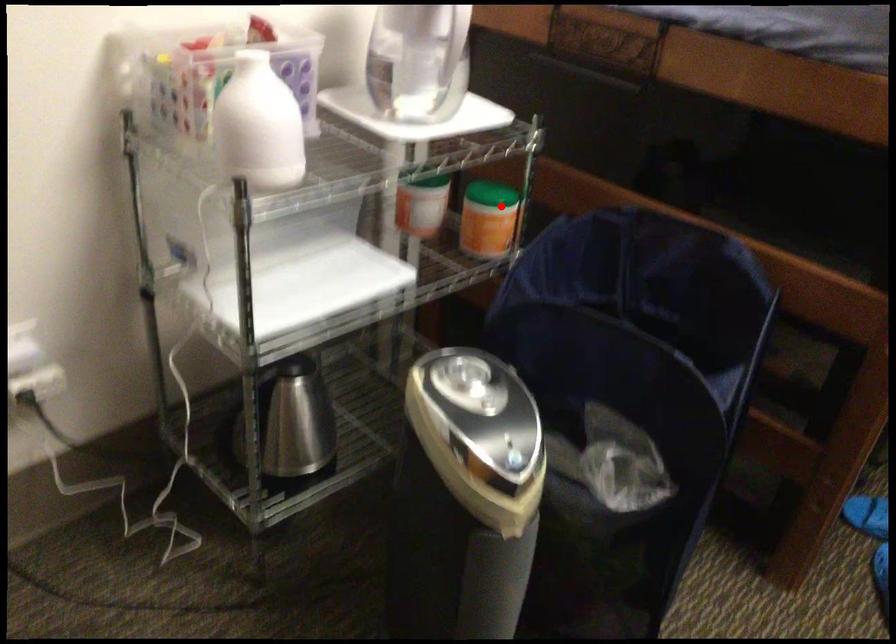
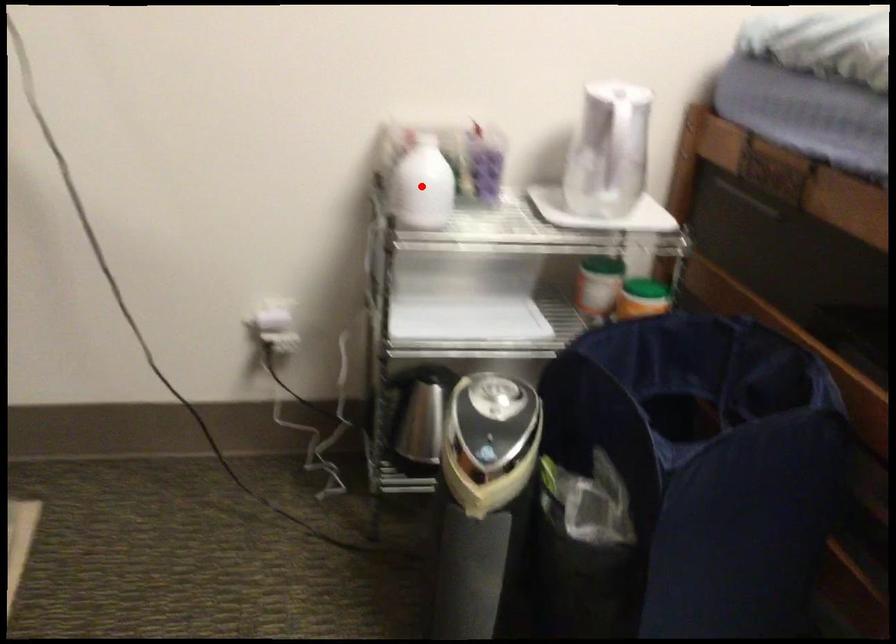
I am providing you with two images of the same scene from different viewpoints. A red point is marked on the first image and another point is marked on the second image. Do the highlighted points in image1 and image2 indicate the same real-world spot?

No